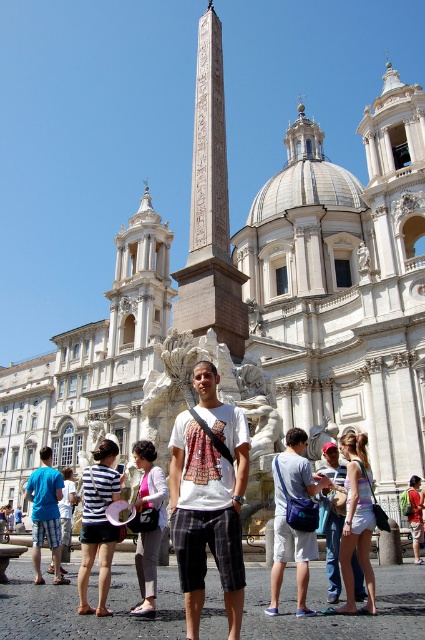
What is the exact location of the striped fabric shirt at center in the image?

The striped fabric shirt at center is located at point coordinates of (67, 509).

You are a tour guide explaining the scene to visitors. Pointing to the carved stone obelisk at center and the matte gray bag at center, you want to highlight their relative sizes. Which object is taller?

The carved stone obelisk at center is much taller than the matte gray bag at center.